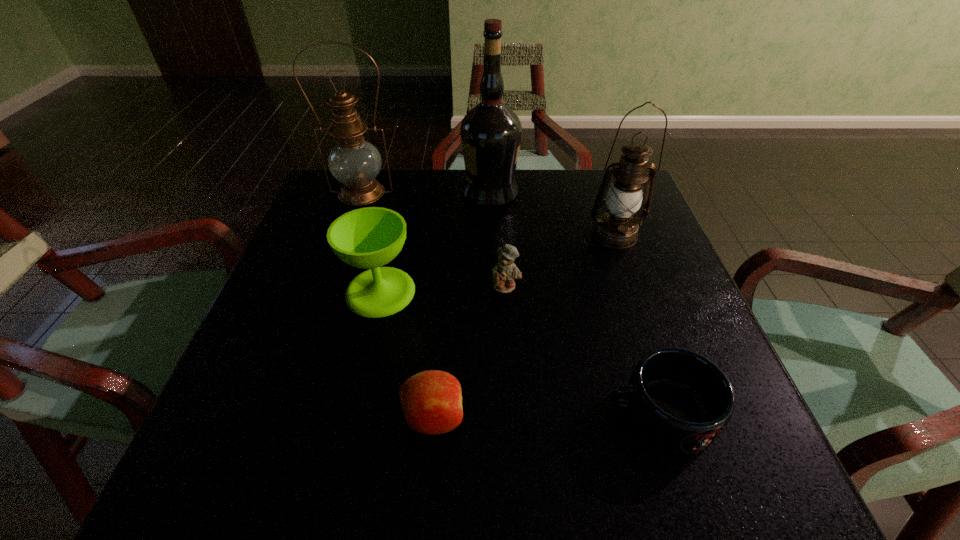
What are the coordinates of `apple situated at the near edge` in the screenshot? It's located at (431, 400).

Where is `mug that is at the near edge`? The width and height of the screenshot is (960, 540). mug that is at the near edge is located at coordinates point(679,401).

Where is `oil lamp at the left edge`? The width and height of the screenshot is (960, 540). oil lamp at the left edge is located at coordinates (353, 161).

The height and width of the screenshot is (540, 960). Identify the location of wineglass that is at the left edge. (368, 238).

Image resolution: width=960 pixels, height=540 pixels. What are the coordinates of `oil lamp positioned at the right edge` in the screenshot? It's located at (x=616, y=228).

This screenshot has height=540, width=960. I want to click on mug at the right edge, so click(x=679, y=401).

Where is `object located in the far left corner section of the desktop`? The width and height of the screenshot is (960, 540). object located in the far left corner section of the desktop is located at coordinates (353, 161).

Where is `object present at the far right corner`? object present at the far right corner is located at coordinates (616, 228).

At what (x,y) coordinates should I click in order to perform the action: click on object at the near right corner. Please return your answer as a coordinate pair (x, y). The image size is (960, 540). Looking at the image, I should click on (679, 401).

Where is `blank space at the far edge`? The image size is (960, 540). blank space at the far edge is located at coordinates (553, 170).